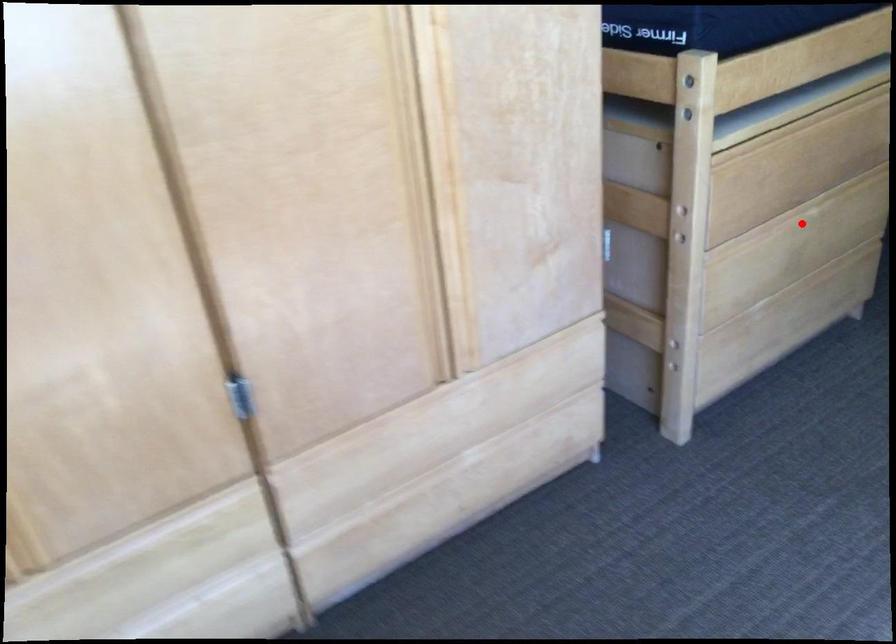
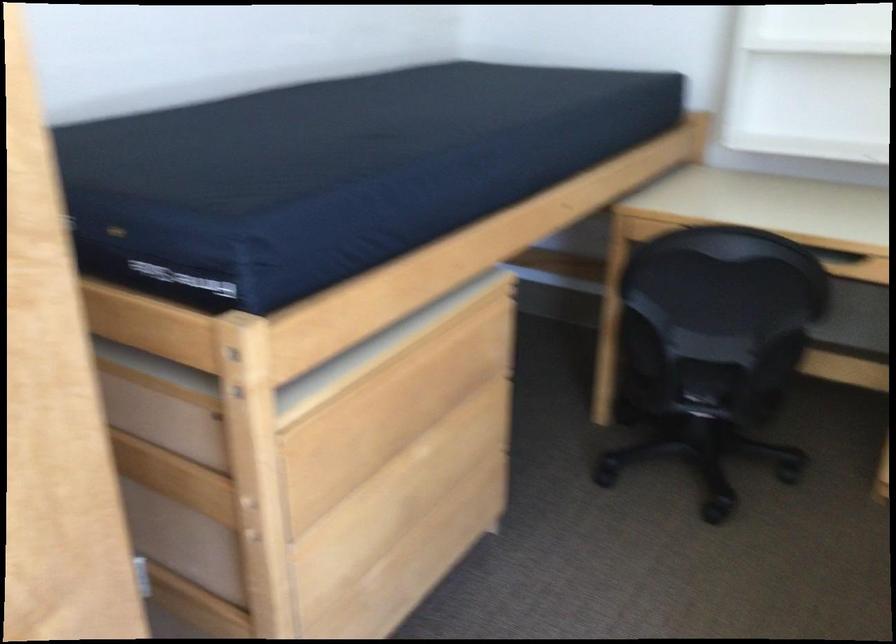
Question: I am providing you with two images of the same scene from different viewpoints. A red point is shown in image1. For the corresponding object point in image2, is it positioned nearer or farther from the camera?

Choices:
 (A) Nearer
 (B) Farther

Answer: (A)